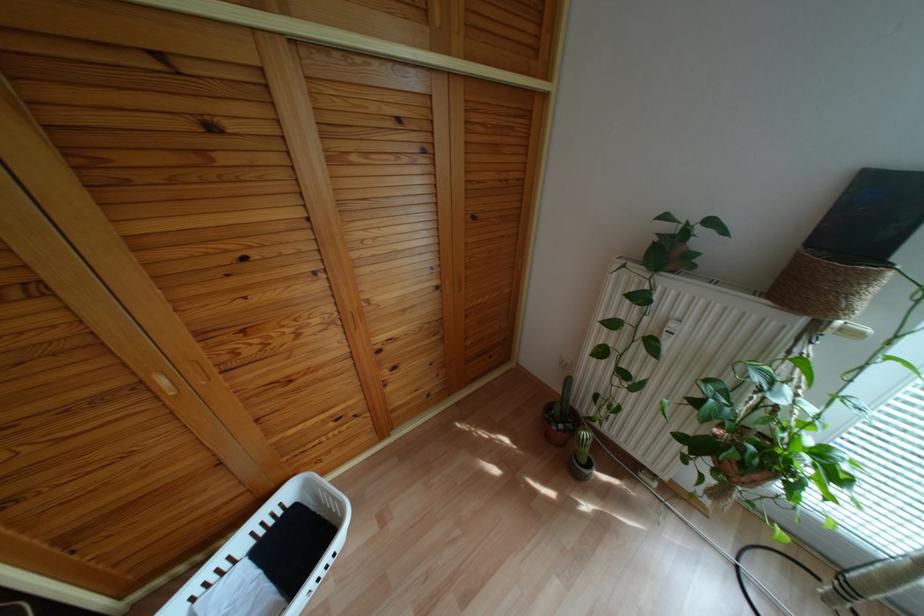
The location [558,426] corresponds to which object?

It corresponds to the grey plant pot in the image.